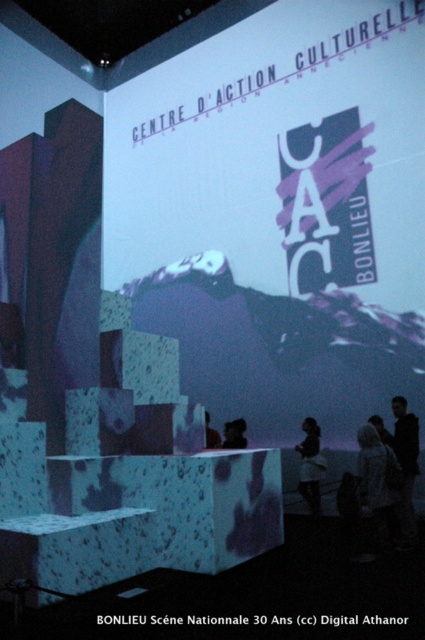
Question: Which point is farther to the camera?

Choices:
 (A) dark hair at center
 (B) matte black person at center

Answer: (B)

Question: Is white matte projection screen at center in front of dark hair at center?

Choices:
 (A) yes
 (B) no

Answer: (B)

Question: Considering the real-world distances, which object is closest to the matte black person at center?

Choices:
 (A) white matte projection screen at center
 (B) white matte dress at lower center
 (C) white textured coat at lower right
 (D) black matte jacket at right

Answer: (B)

Question: Is white matte projection screen at center further to the viewer compared to white textured coat at lower right?

Choices:
 (A) yes
 (B) no

Answer: (A)

Question: Based on their relative distances, which object is nearer to the dark hair at center?

Choices:
 (A) white matte dress at lower center
 (B) black matte jacket at right
 (C) white textured coat at lower right
 (D) matte black person at center

Answer: (D)

Question: Can you confirm if white matte dress at lower center is thinner than dark hair at center?

Choices:
 (A) yes
 (B) no

Answer: (B)